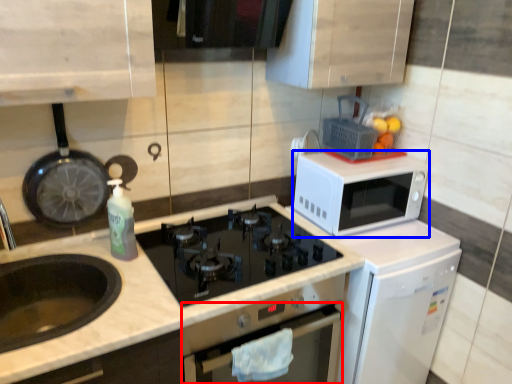
Question: Which object appears closest to the camera in this image, oven (highlighted by a red box) or microwave oven (highlighted by a blue box)?

Choices:
 (A) oven
 (B) microwave oven

Answer: (A)